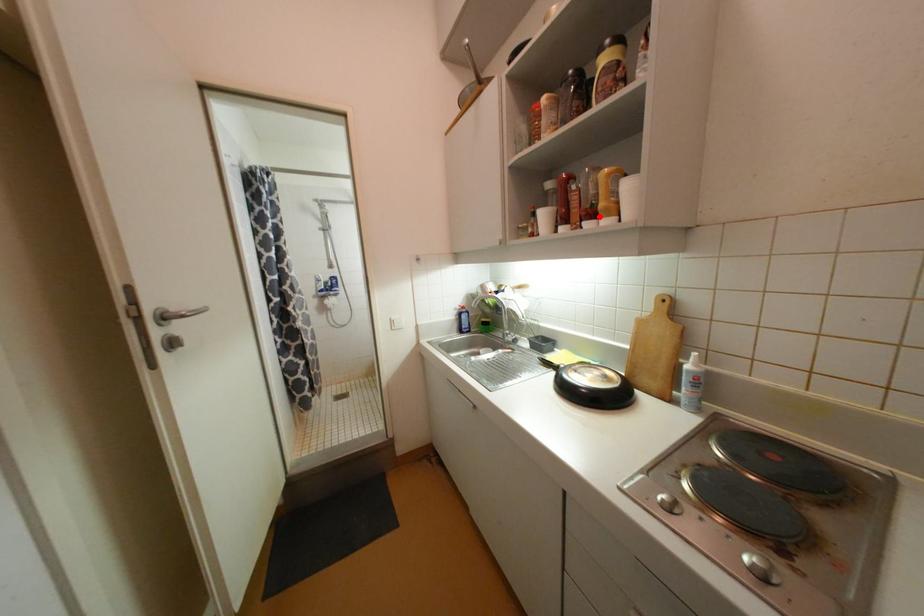
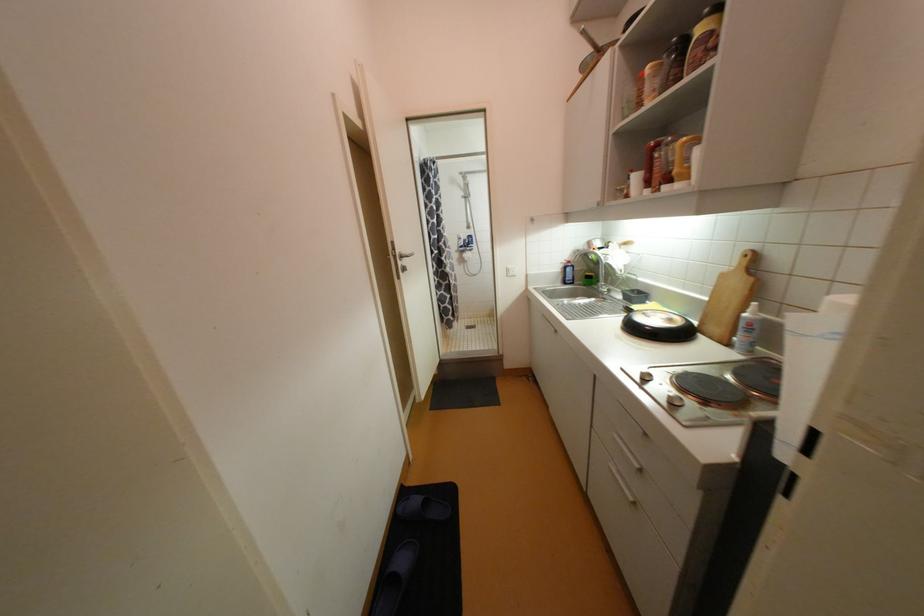
Locate, in the second image, the point that corresponds to the highlighted location in the first image.

(675, 180)